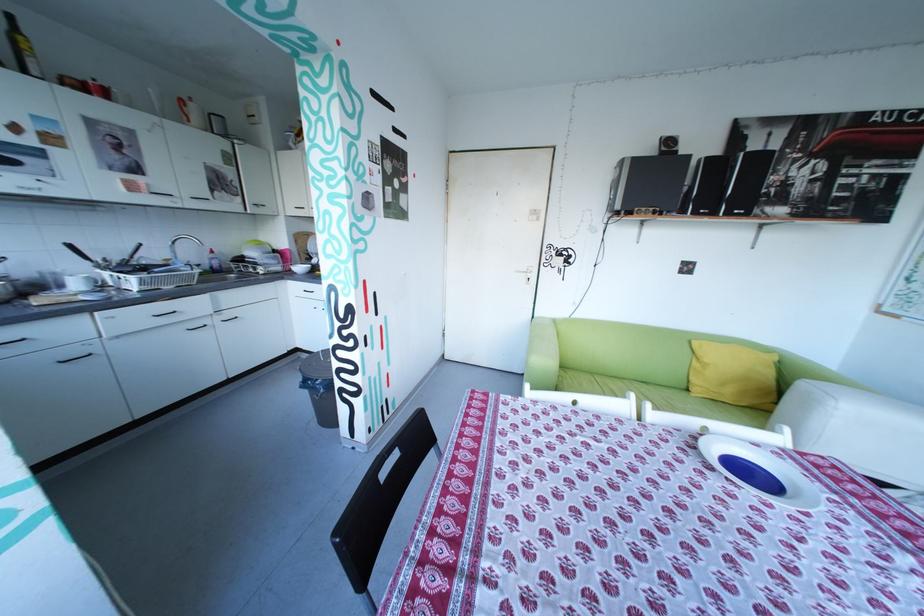
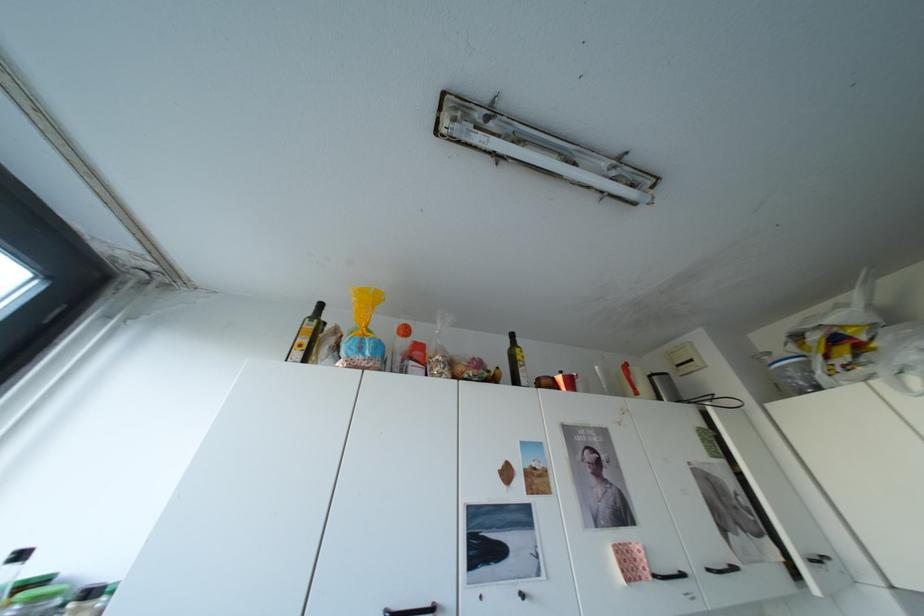
The point at (144, 187) is marked in the first image. Where is the corresponding point in the second image?

(642, 568)